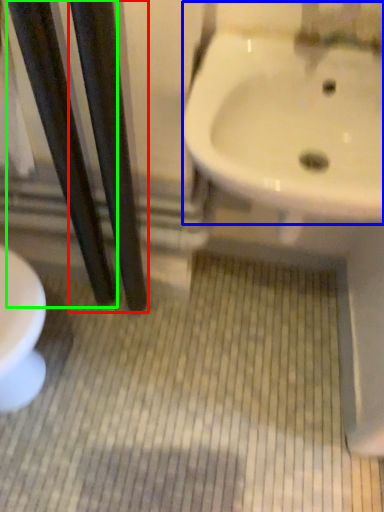
Question: Estimate the real-world distances between objects in this image. Which object is closer to pole (highlighted by a red box), sink (highlighted by a blue box) or pole (highlighted by a green box)?

Choices:
 (A) sink
 (B) pole

Answer: (B)